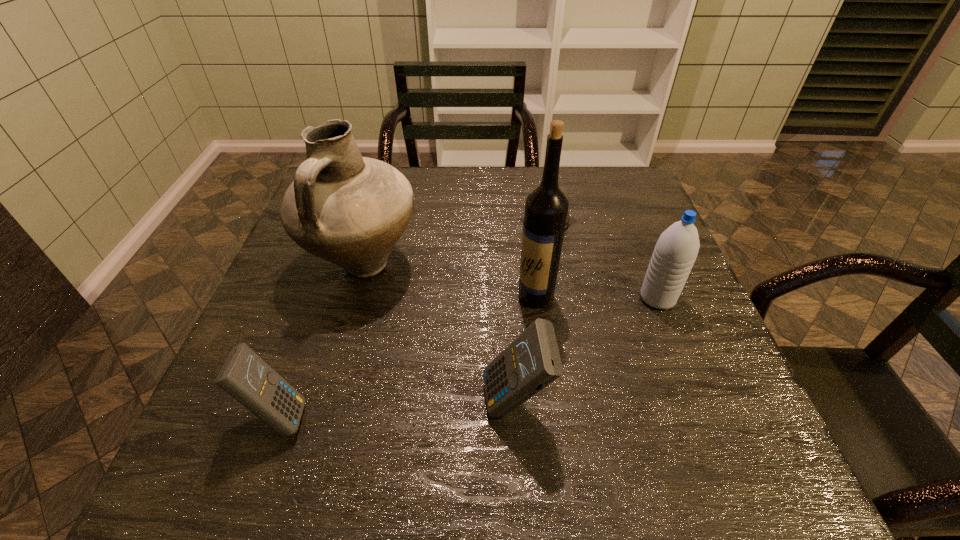
Image resolution: width=960 pixels, height=540 pixels. What are the coordinates of `vacant point located on the front-facing side of the taller calculator` in the screenshot? It's located at (390, 403).

The height and width of the screenshot is (540, 960). What are the coordinates of `free location located on the front-facing side of the taller calculator` in the screenshot? It's located at (346, 403).

Where is `free space located on the front-facing side of the taller calculator`? This screenshot has height=540, width=960. free space located on the front-facing side of the taller calculator is located at coordinates (340, 403).

The image size is (960, 540). Identify the location of vacant area situated 0.130m on the left of the shortest object. (468, 221).

Locate an element on the screen. free space located on the handle side of the pitcher is located at coordinates (331, 379).

Locate an element on the screen. free location located 0.360m on the back of the rightmost object is located at coordinates (617, 197).

This screenshot has width=960, height=540. In order to click on vacant space located 0.200m on the label of the wine bottle in this screenshot , I will do `click(428, 296)`.

Identify the location of free spot located 0.260m on the label of the wine bottle. (401, 296).

Where is `vacant space located on the label of the wine bottle`? vacant space located on the label of the wine bottle is located at coordinates pos(460,296).

At what (x,y) coordinates should I click in order to perform the action: click on object that is at the far edge. Please return your answer as a coordinate pair (x, y). This screenshot has width=960, height=540. Looking at the image, I should click on (568, 216).